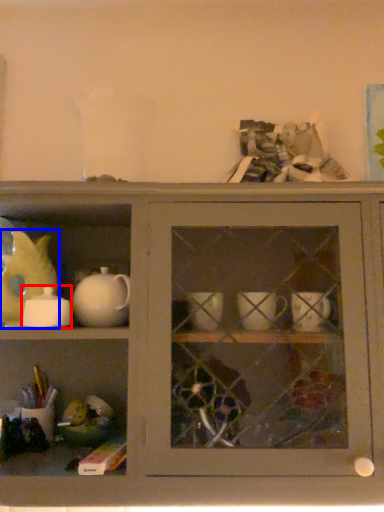
Question: Which object appears farthest to the camera in this image, tableware (highlighted by a red box) or animal (highlighted by a blue box)?

Choices:
 (A) tableware
 (B) animal

Answer: (B)